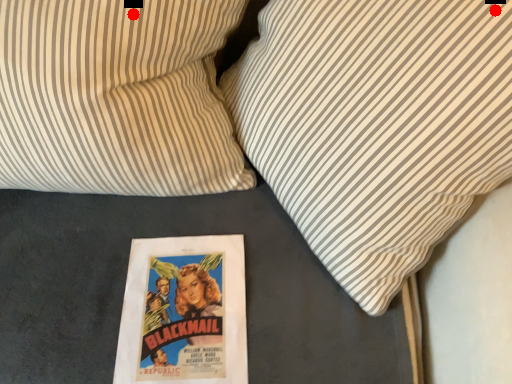
Question: Two points are circled on the image, labeled by A and B beside each circle. Which point is further to the camera?

Choices:
 (A) A is further
 (B) B is further

Answer: (A)